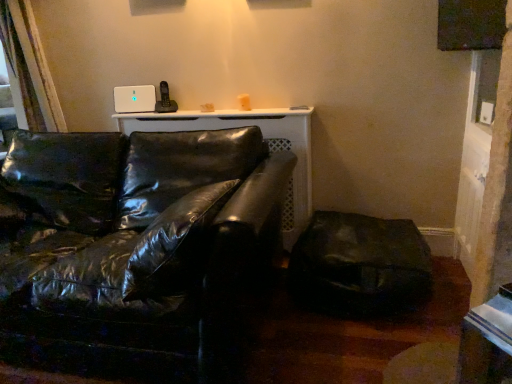
Question: In terms of height, does matte black window screen at upper right look taller or shorter compared to glossy black leather couch at center?

Choices:
 (A) short
 (B) tall

Answer: (A)

Question: Is matte black window screen at upper right to the left or to the right of glossy black leather couch at center in the image?

Choices:
 (A) left
 (B) right

Answer: (B)

Question: Which is farther from the glossy black leather couch at center?

Choices:
 (A) matte black window screen at upper right
 (B) matte black swivel chair at lower right

Answer: (A)

Question: Considering the real-world distances, which object is closest to the matte black swivel chair at lower right?

Choices:
 (A) glossy black leather couch at center
 (B) matte black window screen at upper right

Answer: (A)